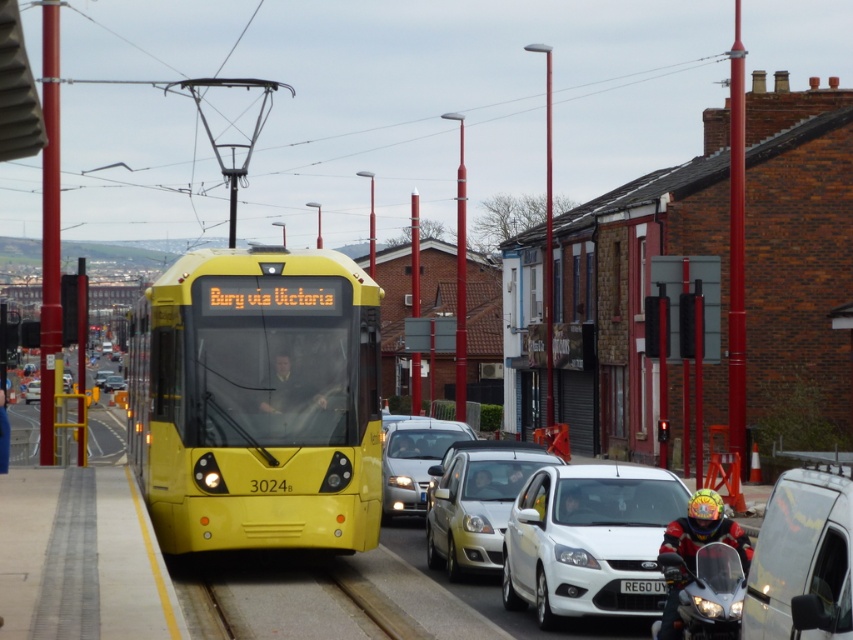
Can you confirm if white glossy car at center is positioned to the right of matte silver sedan at center?

Indeed, white glossy car at center is positioned on the right side of matte silver sedan at center.

At what (x,y) coordinates should I click in order to perform the action: click on white glossy car at center. Please return your answer as a coordinate pair (x, y). Looking at the image, I should click on (587, 540).

Is the position of metal at center less distant than that of red helmeted rider at lower right?

No, metal at center is further to the viewer.

Can you confirm if metal at center is positioned to the left of red helmeted rider at lower right?

Indeed, metal at center is positioned on the left side of red helmeted rider at lower right.

Which is behind, point (368, 630) or point (662, 548)?

Positioned behind is point (368, 630).

Identify the location of metal at center. Image resolution: width=853 pixels, height=640 pixels. (300, 600).

Who is taller, silver metallic sedan at center or smooth leather helmet at center?

silver metallic sedan at center is taller.

From the picture: Can you confirm if silver metallic sedan at center is positioned to the right of smooth leather helmet at center?

In fact, silver metallic sedan at center is to the left of smooth leather helmet at center.

Where is `silver metallic sedan at center`? silver metallic sedan at center is located at coordinates (413, 460).

Locate an element on the screen. silver metallic sedan at center is located at coordinates (413, 460).